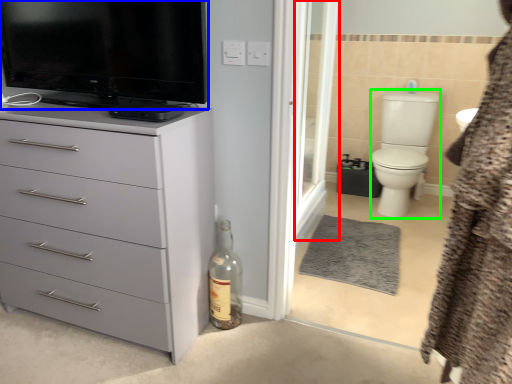
Question: Based on their relative distances, which object is nearer to screen door (highlighted by a red box)? Choose from television (highlighted by a blue box) and toilet bowl (highlighted by a green box).

Choices:
 (A) television
 (B) toilet bowl

Answer: (B)